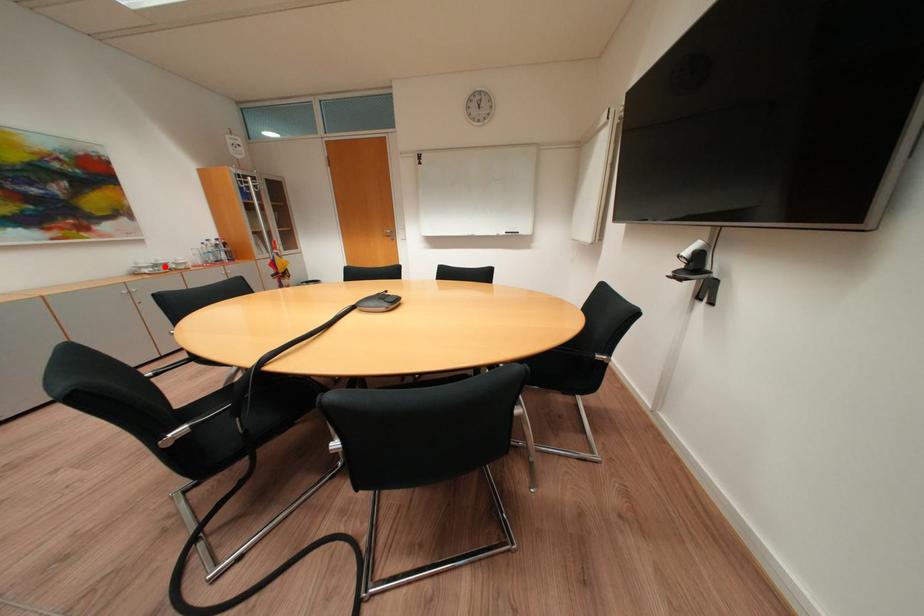
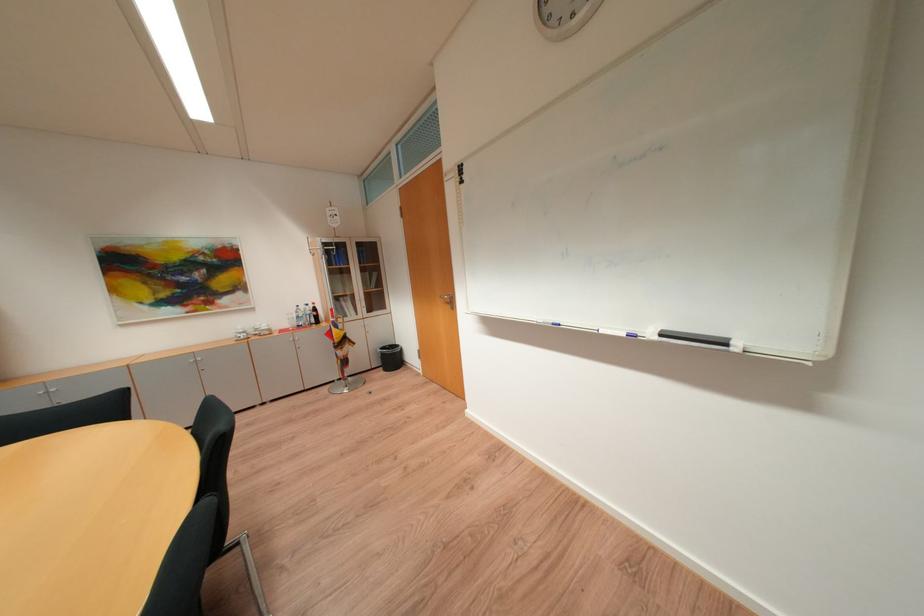
The point at the highlighted location is marked in the first image. Where is the corresponding point in the second image?

(264, 331)